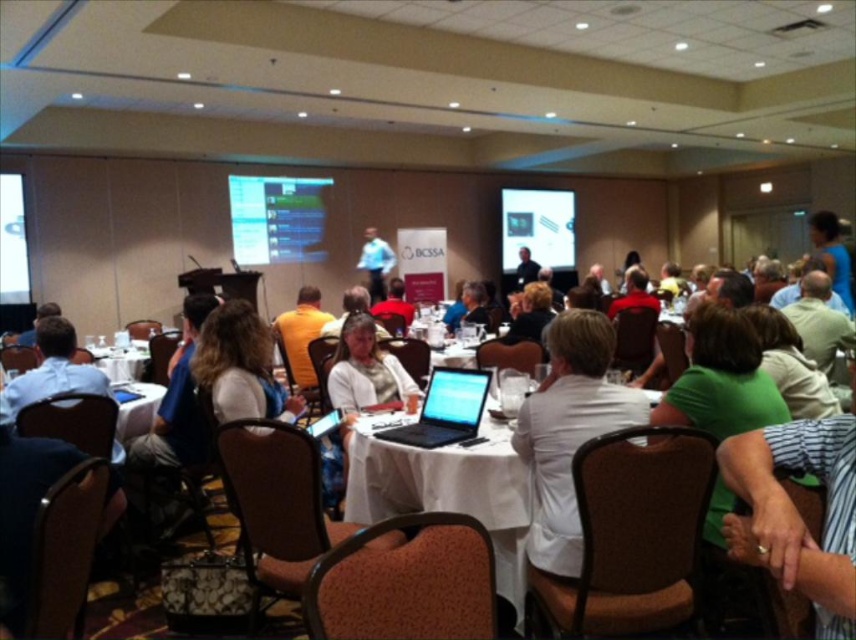
Question: Can you confirm if matte black laptop at center is positioned below yellow shirt at center?

Choices:
 (A) yes
 (B) no

Answer: (A)

Question: Estimate the real-world distances between objects in this image. Which object is farther from the matte black laptop at center?

Choices:
 (A) matte black projector screen at center
 (B) matte black screen at center
 (C) striped fabric shirt at lower right
 (D) black matte laptop at center

Answer: (A)

Question: Can you confirm if white knit sweater at center is positioned above matte black laptop at center?

Choices:
 (A) no
 (B) yes

Answer: (A)

Question: Which point is farther to the camera?

Choices:
 (A) (522, 202)
 (B) (473, 408)

Answer: (A)

Question: Estimate the real-world distances between objects in this image. Which object is closer to the blue shirt at center?

Choices:
 (A) white cloth-covered table at center
 (B) yellow shirt at center

Answer: (B)

Question: Does white fabric shirt at center come in front of blue shirt at center?

Choices:
 (A) no
 (B) yes

Answer: (B)